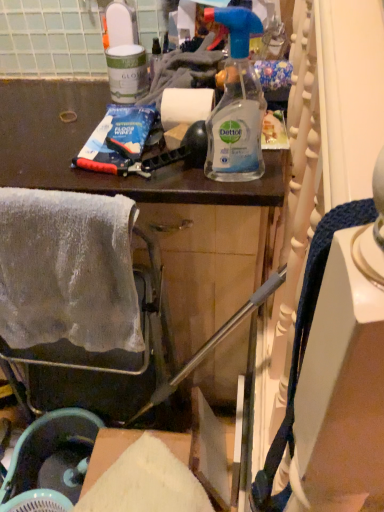
The width and height of the screenshot is (384, 512). Find the location of `vacant space situated on the left part of clear plastic spray bottle at center, which is counted as the second bottle, starting from the back`. vacant space situated on the left part of clear plastic spray bottle at center, which is counted as the second bottle, starting from the back is located at coordinates (141, 182).